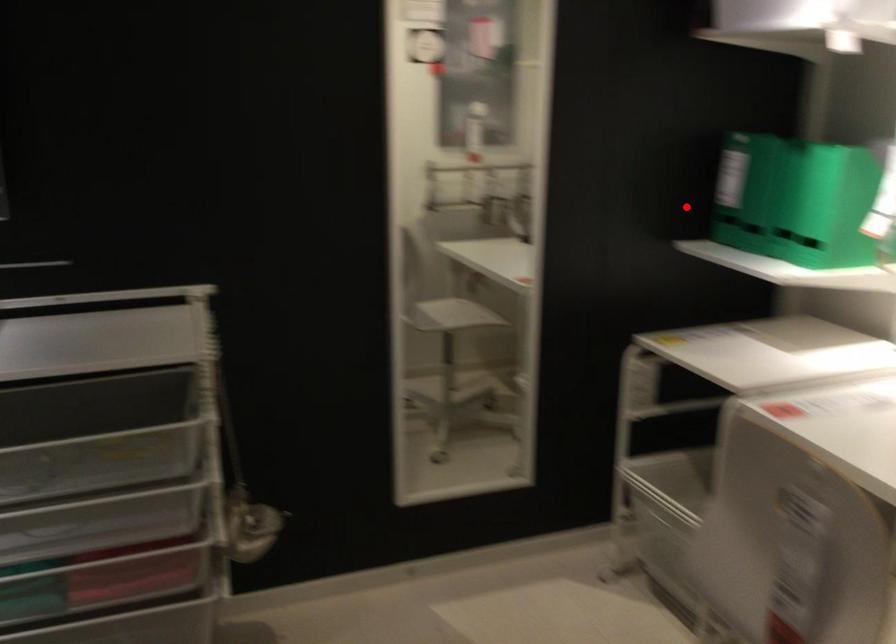
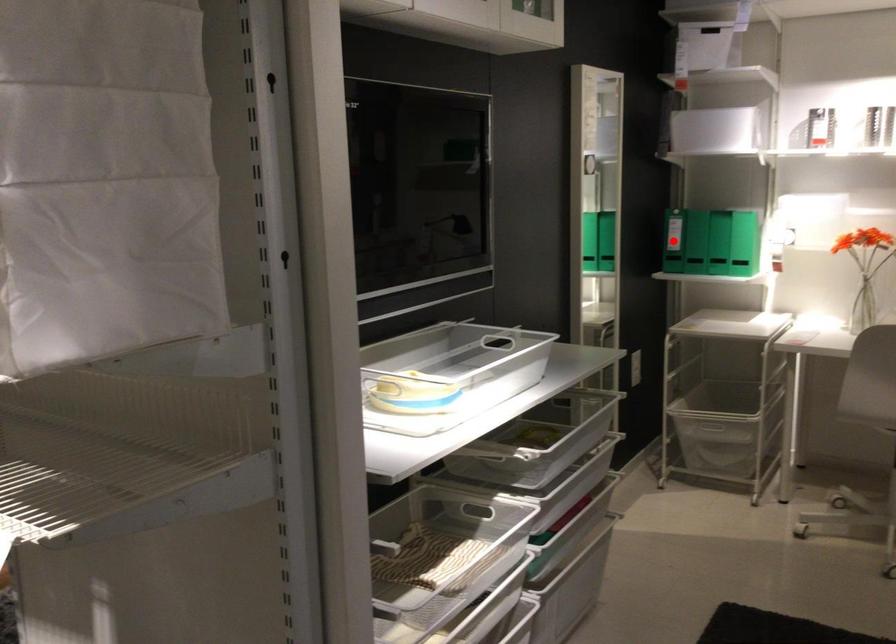
I am providing you with two images of the same scene from different viewpoints. A red point is marked on the first image and another point is marked on the second image. Are the points marked in image1 and image2 representing the same 3D position?

Yes